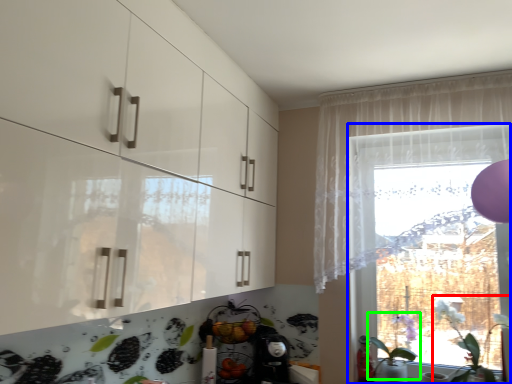
Question: Which object is positioned closest to plant (highlighted by a red box)? Select from window (highlighted by a blue box) and plant (highlighted by a green box).

Choices:
 (A) window
 (B) plant

Answer: (B)